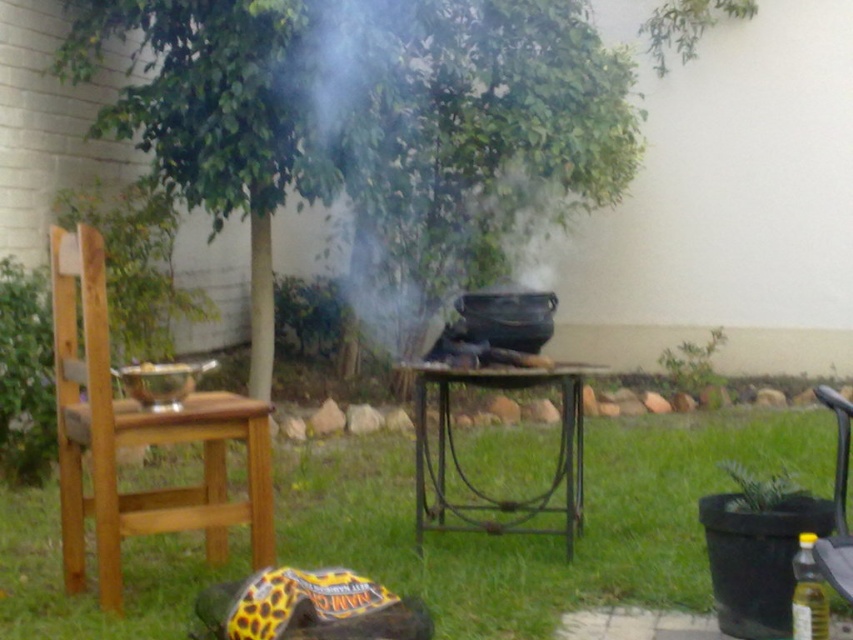
Who is higher up, green grass at lower center or iron/metallic table at center?

iron/metallic table at center is higher up.

How much distance is there between green grass at lower center and iron/metallic table at center?

They are 4.33 feet apart.

I want to click on green grass at lower center, so click(x=543, y=536).

Find the location of a particular element. The height and width of the screenshot is (640, 853). green grass at lower center is located at coordinates (543, 536).

From the picture: Measure the distance between iron/metallic table at center and camera.

12.60 feet

Can you confirm if iron/metallic table at center is bigger than black plastic chair at lower right?

Yes, iron/metallic table at center is bigger than black plastic chair at lower right.

What do you see at coordinates (463, 472) in the screenshot? The height and width of the screenshot is (640, 853). I see `iron/metallic table at center` at bounding box center [463, 472].

Image resolution: width=853 pixels, height=640 pixels. What are the coordinates of `iron/metallic table at center` in the screenshot? It's located at 463,472.

Does wooden chair at left have a smaller size compared to iron/metallic table at center?

Yes, wooden chair at left is smaller than iron/metallic table at center.

Is wooden chair at left to the right of iron/metallic table at center from the viewer's perspective?

No, wooden chair at left is not to the right of iron/metallic table at center.

Does point (65, 403) come in front of point (421, 506)?

Yes, it is.

Where is `wooden chair at left`? The image size is (853, 640). wooden chair at left is located at coordinates (140, 438).